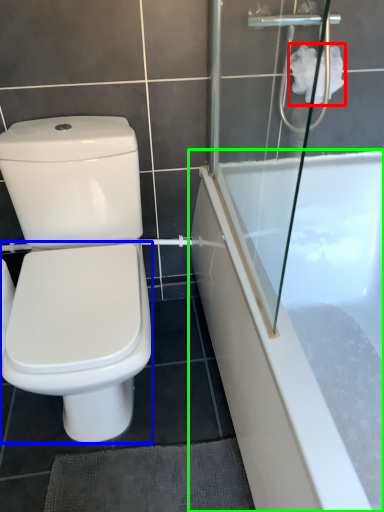
Question: Considering the real-world distances, which object is farthest from toilet paper (highlighted by a red box)? bidet (highlighted by a blue box) or bathtub (highlighted by a green box)?

Choices:
 (A) bidet
 (B) bathtub

Answer: (A)